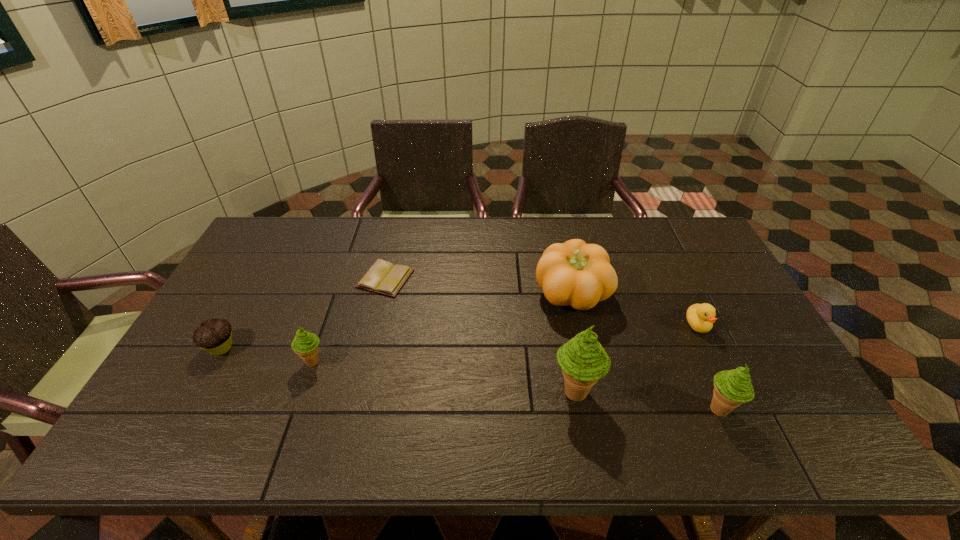
You are a GUI agent. You are given a task and a screenshot of the screen. Output one action in this format:
    pyautogui.click(x=<x>, y=<y>)
    Task: Click on the free space between the second tallest icecream and the pumpkin
    The height and width of the screenshot is (540, 960).
    Given the screenshot: What is the action you would take?
    pyautogui.click(x=646, y=352)

Where is `empty space between the second icecream from left to right and the duckling`? This screenshot has height=540, width=960. empty space between the second icecream from left to right and the duckling is located at coordinates (636, 359).

Where is `unoccupied position between the muffin and the diary`? The image size is (960, 540). unoccupied position between the muffin and the diary is located at coordinates (303, 313).

You are a GUI agent. You are given a task and a screenshot of the screen. Output one action in this format:
    pyautogui.click(x=<x>, y=<y>)
    Task: Click on the free space between the leftmost object and the shortest icecream
    This screenshot has height=540, width=960.
    Given the screenshot: What is the action you would take?
    pyautogui.click(x=267, y=355)

Choose which object is the fourth nearest neighbor to the tallest object. Please provide its 2D coordinates. Your answer should be formatted as a tuple, i.e. [(x, y)], where the tuple contains the x and y coordinates of a point satisfying the conditions above.

[(383, 277)]

Find the location of `object that ranks as the fifth closest to the shortest icecream`. object that ranks as the fifth closest to the shortest icecream is located at coordinates (732, 388).

Identify which icecream is the closest to the second object from left to right. Please provide its 2D coordinates. Your answer should be formatted as a tuple, i.e. [(x, y)], where the tuple contains the x and y coordinates of a point satisfying the conditions above.

[(583, 360)]

What are the coordinates of `icecream that can be found as the second closest to the shortest object` in the screenshot? It's located at (583, 360).